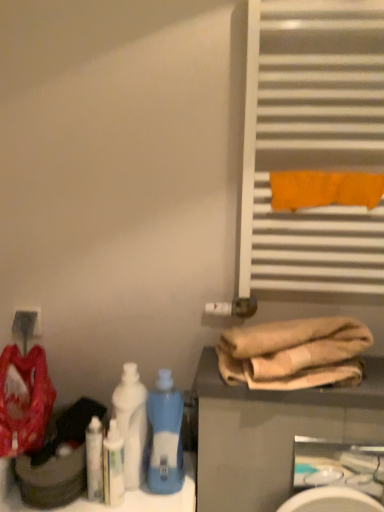
Question: Considering their positions, is white plastic bottle at center, the 2th bottle positioned from the right, located in front of or behind matte red fabric at left?

Choices:
 (A) behind
 (B) front

Answer: (A)

Question: From a real-world perspective, relative to matte red fabric at left, is white plastic bottle at center, the 2th bottle positioned from the right, vertically above or below?

Choices:
 (A) above
 (B) below

Answer: (B)

Question: Estimate the real-world distances between objects in this image. Which object is closer to the white glossy sink at lower right?

Choices:
 (A) matte white electric outlet at lower left
 (B) blue plastic bottle at center, the second bottle when ordered from left to right
 (C) white plastic bottle at center, the 2th bottle positioned from the right
 (D) white metallic radiator at upper right
 (E) white glossy bottle at lower left, the 2th cleaning product when ordered from right to left

Answer: (B)

Question: Based on their relative distances, which object is farther from the beige cotton towels at lower right?

Choices:
 (A) white metallic radiator at upper right
 (B) matte white electric outlet at lower left
 (C) white glossy bottle at lower left, which is the first cleaning product from left to right
 (D) white plastic bottle at center, the first bottle positioned from the left
 (E) white glossy bottle at lower left, marked as the 2th cleaning product in a left-to-right arrangement

Answer: (B)